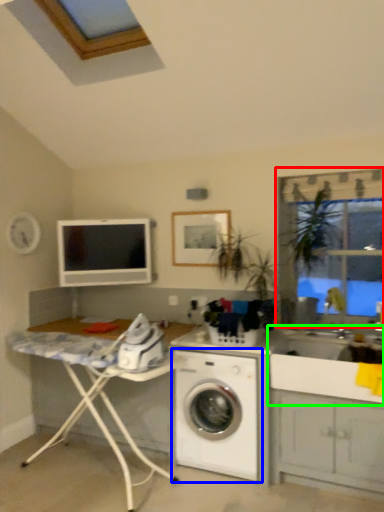
Question: Which object is the farthest from window frame (highlighted by a red box)? Choose among these: washing machine (highlighted by a blue box) or sink (highlighted by a green box).

Choices:
 (A) washing machine
 (B) sink

Answer: (A)